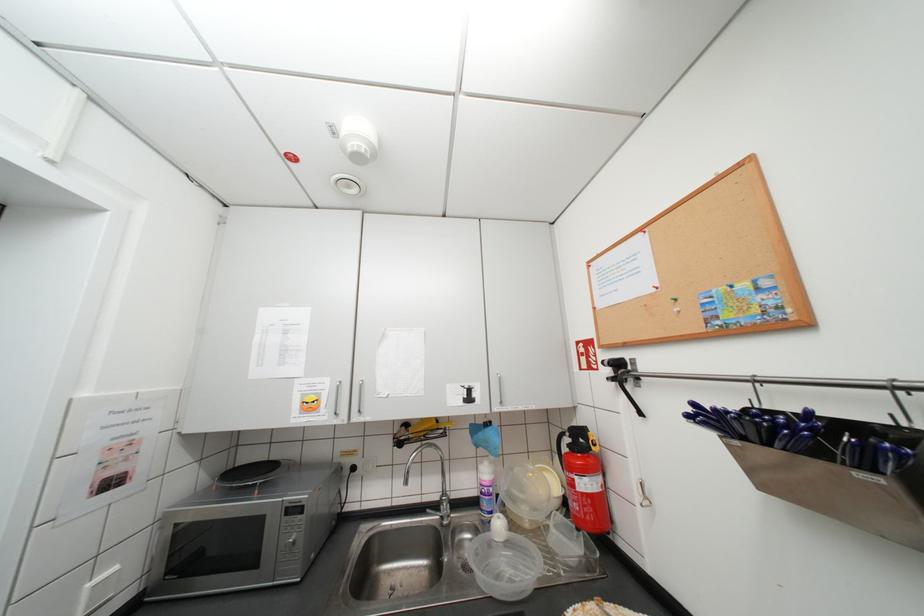
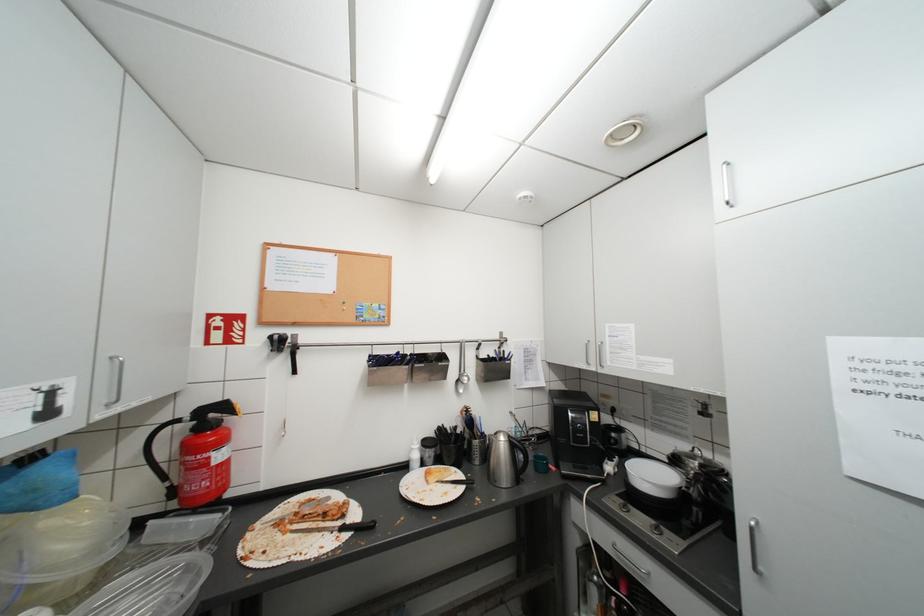
Question: The images are taken continuously from a first-person perspective. In which direction is your viewpoint rotating?

Choices:
 (A) Left
 (B) Right
 (C) Up
 (D) Down

Answer: (B)